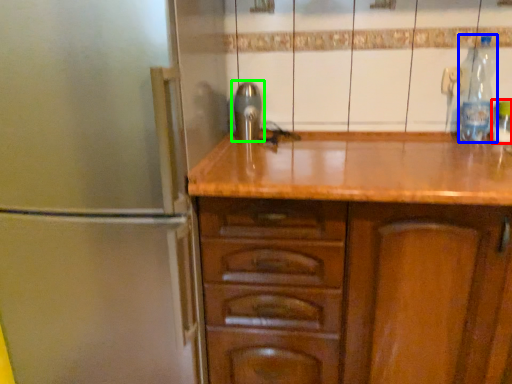
Question: Based on their relative distances, which object is nearer to bottle (highlighted by a red box)? Choose from bottle (highlighted by a blue box) and tap (highlighted by a green box).

Choices:
 (A) bottle
 (B) tap

Answer: (A)